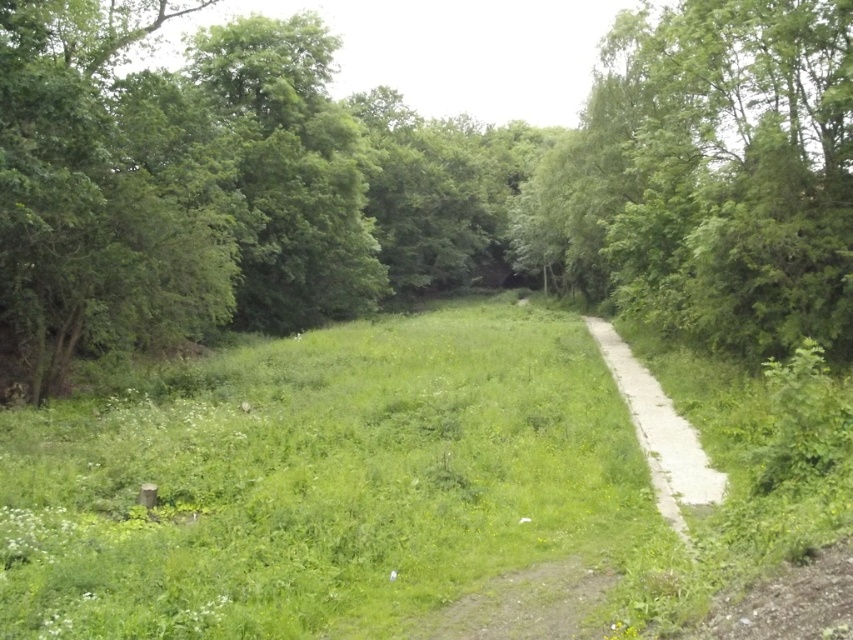
You are a hiker standing on the white gravel path at center. You want to reach the green leafy tree at center. In which direction should you walk?

The green leafy tree at center is to the left of the white gravel path at center, so you should walk to the left to reach it.

Looking at this image, you are a hiker planning to walk along the paths in this serene natural scene. The brown gravel path at center and the white gravel path at center are both visible. Which path should you choose if you want to stay on the left side of the main path?

You should choose the brown gravel path at center because it is positioned to the left of the white gravel path at center according to the description.

You are standing at the starting point of the path and want to reach the end of the path. Which of the two points, point (590, 230) or point (440, 636), is closer to you as you begin your journey?

Point (590, 230) is closer to you because it is further to the viewer than point (440, 636), which means it is nearer to your starting position.